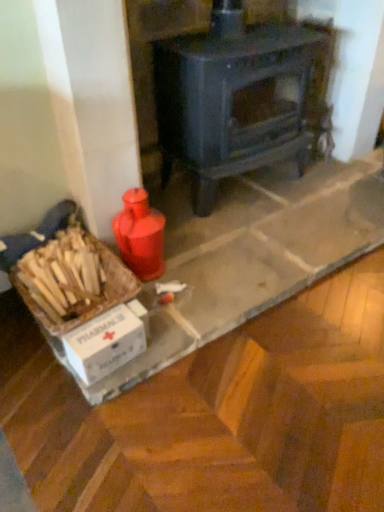
Locate an element on the screen. vacant space situated above white cardboard box at lower left (from a real-world perspective) is located at coordinates (100, 328).